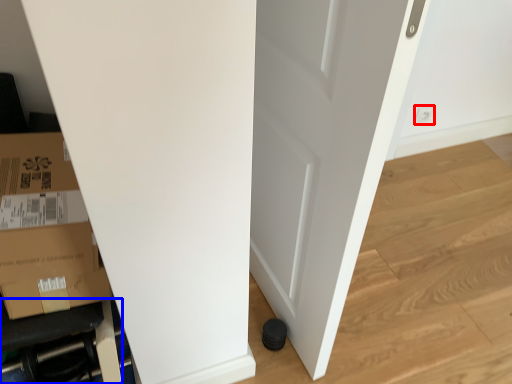
Question: Which point is closer to the camera, electric outlet (highlighted by a red box) or furniture (highlighted by a blue box)?

Choices:
 (A) electric outlet
 (B) furniture

Answer: (B)